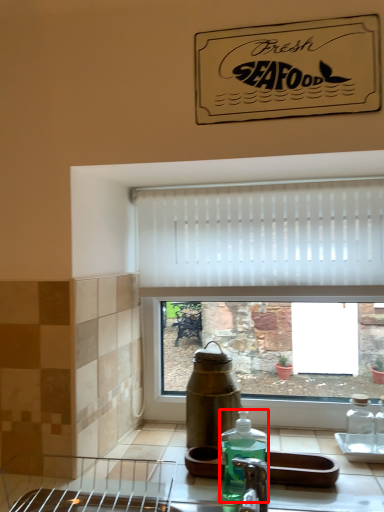
Question: Where is bottle (annotated by the red box) located in relation to curtain in the image?

Choices:
 (A) left
 (B) right

Answer: (A)